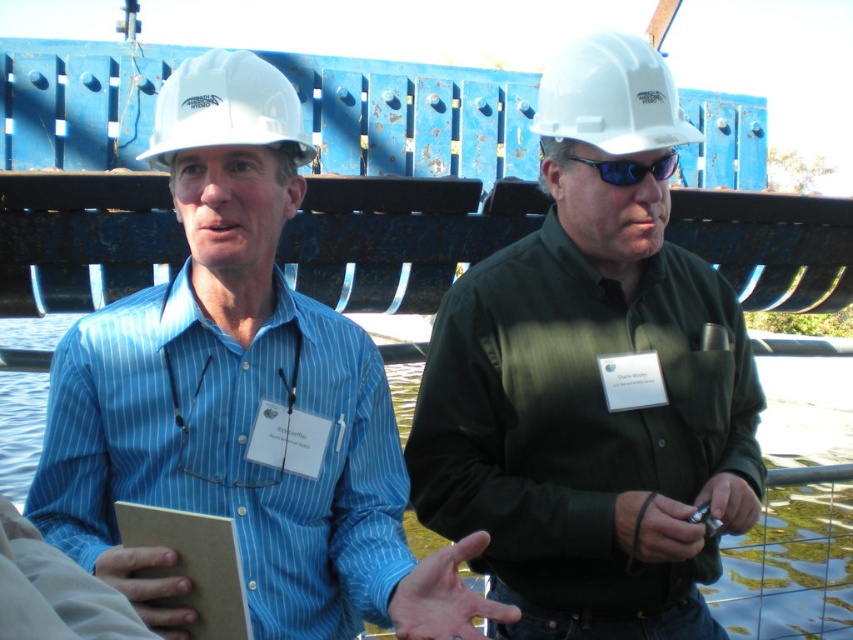
Question: Which point is closer to the camera?

Choices:
 (A) (659, 172)
 (B) (605, 65)
 (C) (235, 54)
 (D) (643, 460)

Answer: (C)

Question: Which of the following is the closest to the observer?

Choices:
 (A) coord(672,83)
 (B) coord(630,170)
 (C) coord(347,477)
 (D) coord(730,324)

Answer: (B)

Question: Observing the image, what is the correct spatial positioning of white hard hat at upper left in reference to sunglasses at center?

Choices:
 (A) below
 (B) above

Answer: (B)

Question: Which point is closer to the camera?

Choices:
 (A) (392, 481)
 (B) (556, 77)
 (C) (573, 157)
 (D) (196, 141)

Answer: (D)

Question: Does matte black shirt at center come behind sunglasses at center?

Choices:
 (A) no
 (B) yes

Answer: (A)

Question: Does blue striped shirt at left lie in front of white hard hat at upper left?

Choices:
 (A) no
 (B) yes

Answer: (B)